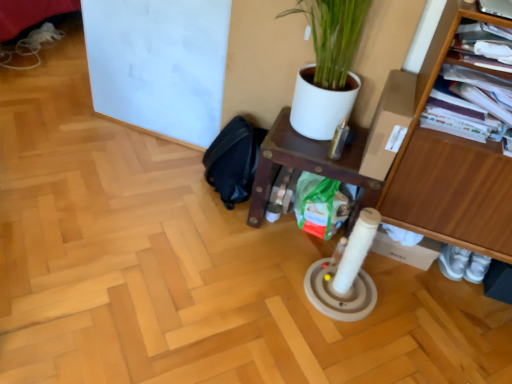
Locate an element on the screen. Image resolution: width=512 pixels, height=384 pixels. free space to the left of black fabric swivel chair at lower center is located at coordinates (165, 180).